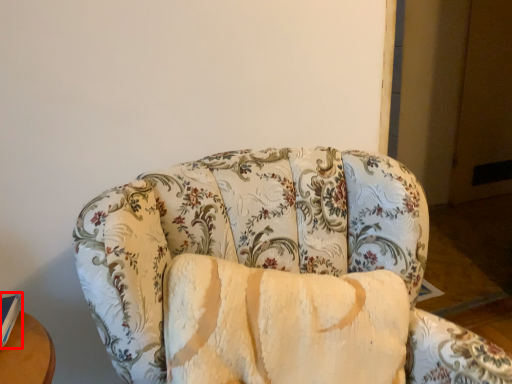
Question: From the image's perspective, what is the correct spatial positioning of book (annotated by the red box) in reference to studio couch?

Choices:
 (A) below
 (B) above

Answer: (B)